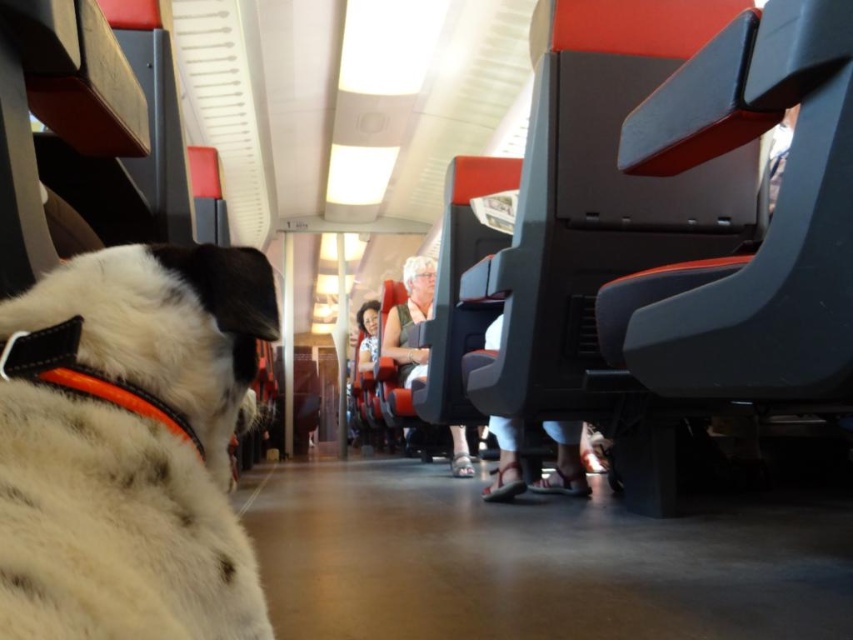
Which is above, white fabric pants at center or matte black shirt at center?

Positioned higher is matte black shirt at center.

Image resolution: width=853 pixels, height=640 pixels. Identify the location of white fabric pants at center. (564, 460).

Does point (495, 432) lie in front of point (410, 348)?

Yes, it is in front of point (410, 348).

Locate an element on the screen. white fabric pants at center is located at coordinates (564, 460).

This screenshot has width=853, height=640. In order to click on white fabric pants at center in this screenshot , I will do `click(564, 460)`.

Consider the image. Between white fabric pants at center and smooth skin face at center, which one has less height?

white fabric pants at center is shorter.

Describe the element at coordinates (564, 460) in the screenshot. This screenshot has width=853, height=640. I see `white fabric pants at center` at that location.

Locate an element on the screen. This screenshot has width=853, height=640. white fabric pants at center is located at coordinates (564, 460).

Is white fur at left behind white fabric pants at center?

No, it is not.

Describe the element at coordinates (129, 445) in the screenshot. The height and width of the screenshot is (640, 853). I see `white fur at left` at that location.

Between point (189, 563) and point (492, 333), which one is positioned behind?

Point (492, 333)

You are a GUI agent. You are given a task and a screenshot of the screen. Output one action in this format:
    pyautogui.click(x=<x>, y=<y>)
    Task: Click on the white fur at left
    This screenshot has height=640, width=853.
    Given the screenshot: What is the action you would take?
    pyautogui.click(x=129, y=445)